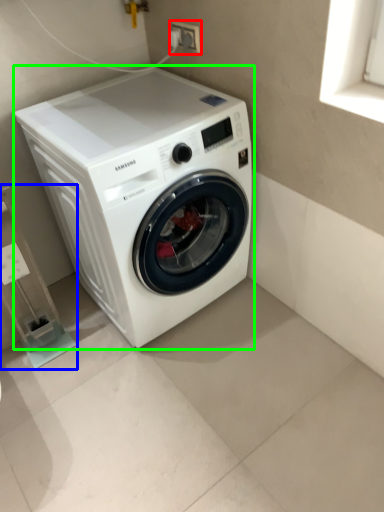
Question: Which object is the closest to the electric outlet (highlighted by a red box)? Choose among these: shelf (highlighted by a blue box) or washing machine (highlighted by a green box).

Choices:
 (A) shelf
 (B) washing machine

Answer: (B)